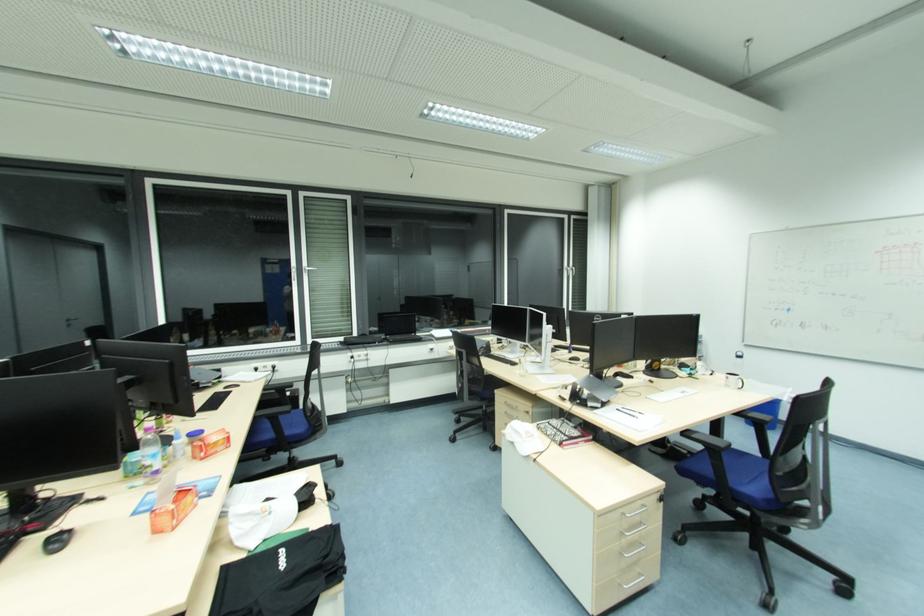
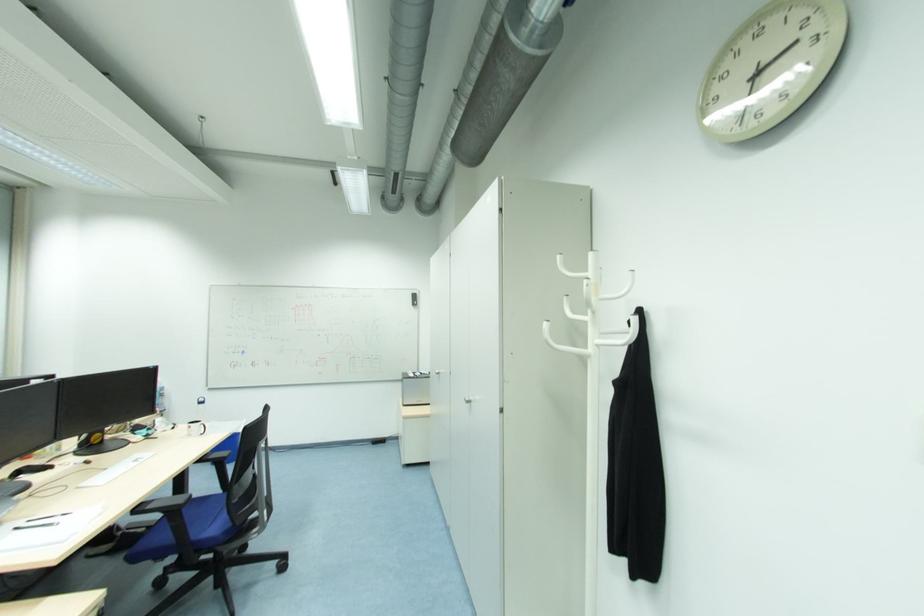
Locate, in the second image, the point that corresponds to (x=689, y=435) in the first image.

(142, 511)